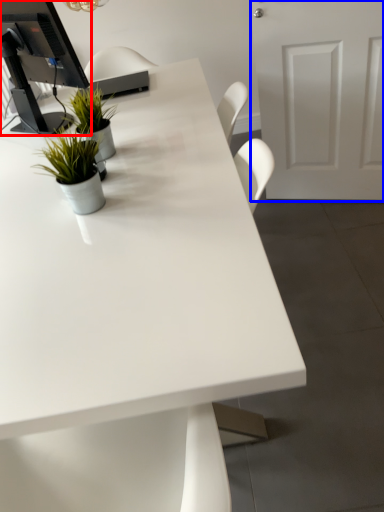
Question: Which point is closer to the camera, desktop computer (highlighted by a red box) or door (highlighted by a blue box)?

Choices:
 (A) desktop computer
 (B) door

Answer: (A)